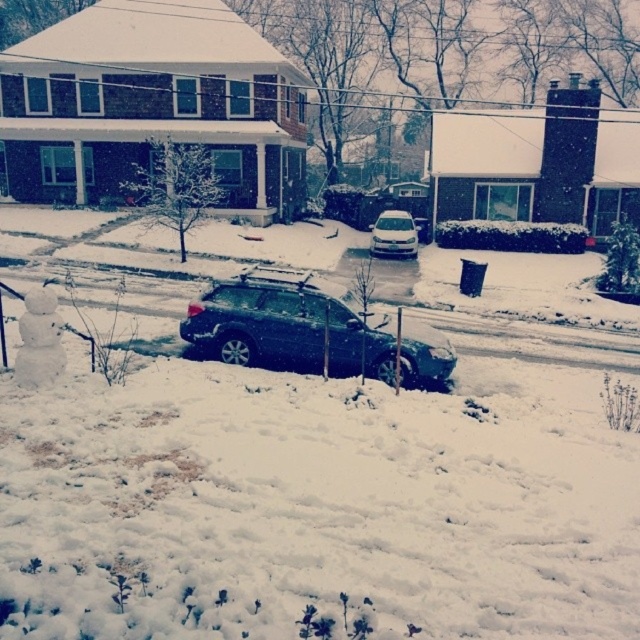
You are standing on the sidewalk in front of the house and want to walk to the snowman. Which point, point (348, 292) or point (381, 214), is closer to your current position?

Point (348, 292) is closer to the viewer than point (381, 214), so it is closer to your current position on the sidewalk.

You are a delivery driver who needs to park your truck between the satin black suv at center and the white matte car at center. Can you fit your truck, which is 6 meters long, in the space between them?

The satin black suv at center is smaller than the white matte car at center, but the distance between them is not provided. Without knowing the exact space between the two vehicles, it is impossible to determine if the truck will fit.